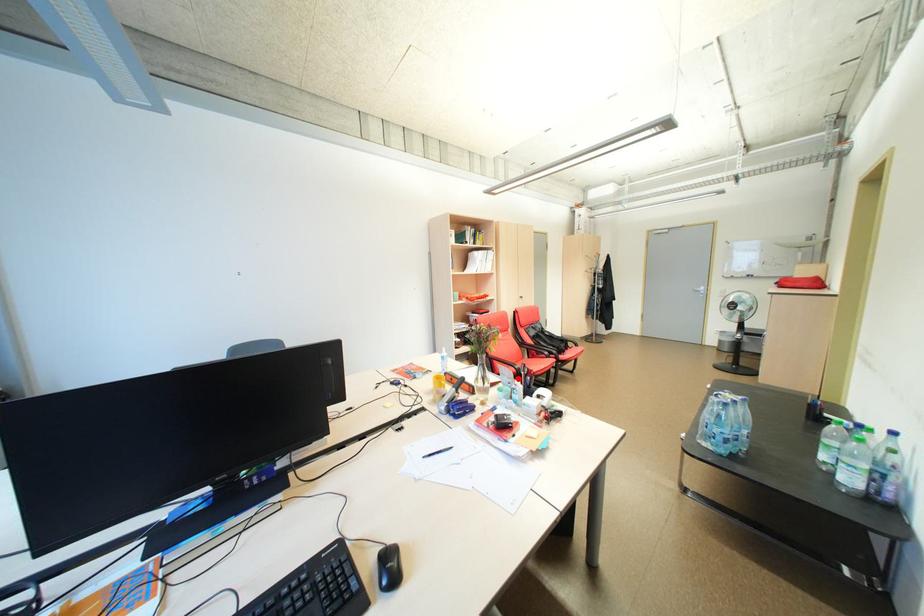
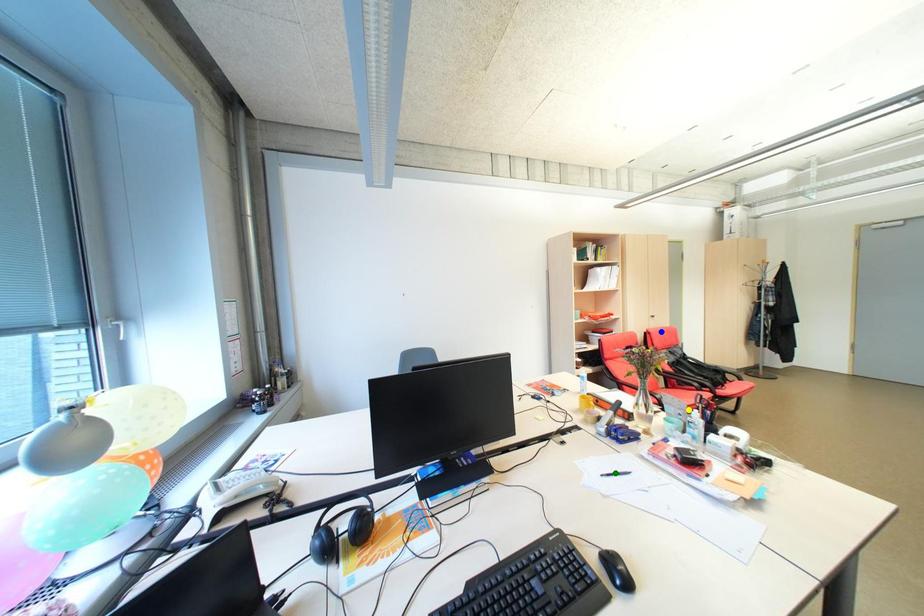
Question: I am providing you with two images of the same scene from different viewpoints. A red point is marked on the first image. You are given multiple points on the second image. In image 2, which mark is for the same physical point as the one in image 1?

Choices:
 (A) blue point
 (B) green point
 (C) yellow point

Answer: (C)